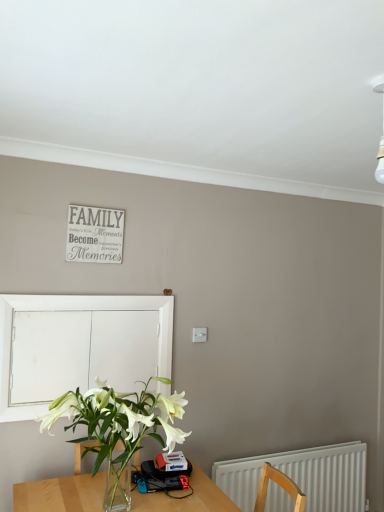
Question: Should I look upward or downward to see white plastic radiator at lower right?

Choices:
 (A) down
 (B) up

Answer: (A)

Question: Can you confirm if white matte signboard at upper center is bigger than white plastic radiator at lower right?

Choices:
 (A) yes
 (B) no

Answer: (B)

Question: Is white matte signboard at upper center shorter than white plastic radiator at lower right?

Choices:
 (A) yes
 (B) no

Answer: (A)

Question: Is the position of white matte signboard at upper center more distant than that of white plastic radiator at lower right?

Choices:
 (A) no
 (B) yes

Answer: (A)

Question: From the image's perspective, does white matte signboard at upper center appear higher than white plastic radiator at lower right?

Choices:
 (A) no
 (B) yes

Answer: (B)

Question: Is white matte signboard at upper center aimed at white plastic radiator at lower right?

Choices:
 (A) no
 (B) yes

Answer: (A)

Question: Does white matte signboard at upper center appear on the right side of white plastic radiator at lower right?

Choices:
 (A) no
 (B) yes

Answer: (A)

Question: From the image's perspective, is white plastic radiator at lower right located beneath white matte window screen at left?

Choices:
 (A) yes
 (B) no

Answer: (A)

Question: Is the depth of white plastic radiator at lower right less than that of white matte window screen at left?

Choices:
 (A) no
 (B) yes

Answer: (A)

Question: Is white matte window screen at left at the back of white plastic radiator at lower right?

Choices:
 (A) no
 (B) yes

Answer: (A)

Question: Would you say white plastic radiator at lower right contains white matte window screen at left?

Choices:
 (A) no
 (B) yes

Answer: (A)

Question: From a real-world perspective, does white plastic radiator at lower right sit lower than white matte window screen at left?

Choices:
 (A) no
 (B) yes

Answer: (B)

Question: Is the depth of white plastic radiator at lower right greater than that of white matte window screen at left?

Choices:
 (A) yes
 (B) no

Answer: (A)

Question: Does white matte window screen at left have a greater height compared to white matte signboard at upper center?

Choices:
 (A) no
 (B) yes

Answer: (B)